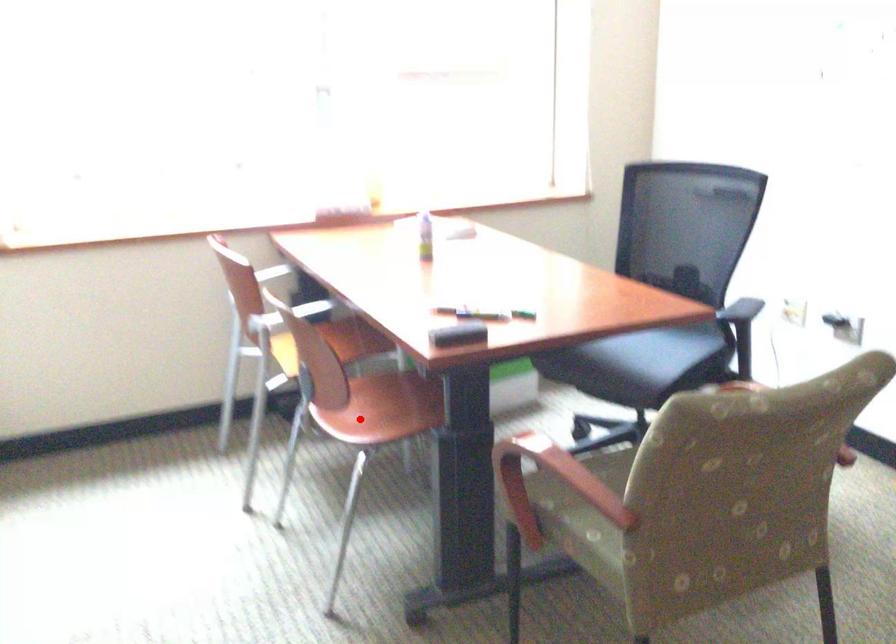
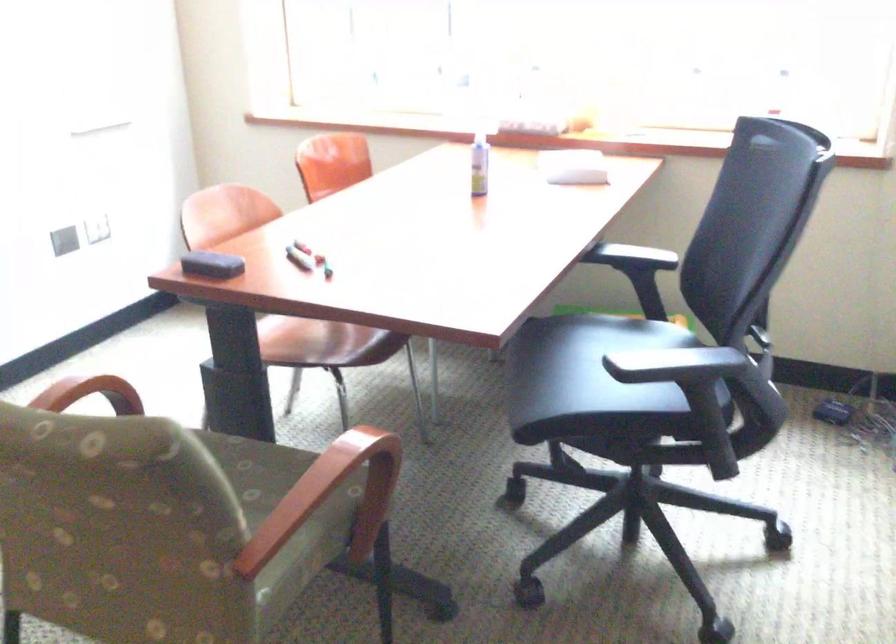
In the second image, find the point that corresponds to the highlighted location in the first image.

(295, 336)